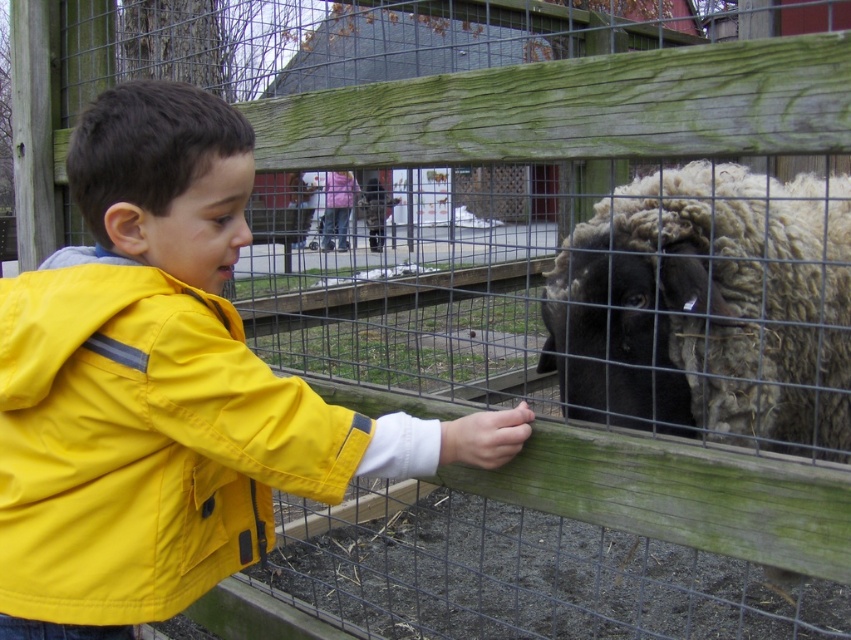
Is yellow matte jacket at center below yellow matte jacket at left?

No.

Is the position of yellow matte jacket at center more distant than that of yellow matte jacket at left?

Yes, yellow matte jacket at center is further from the viewer.

Is point (92, 148) behind point (237, 368)?

Yes, point (92, 148) is farther from viewer.

Find the location of a particular element. The width and height of the screenshot is (851, 640). yellow matte jacket at center is located at coordinates (164, 387).

Can you confirm if yellow matte jacket at center is positioned to the left of black woolly sheep at center?

Yes, yellow matte jacket at center is to the left of black woolly sheep at center.

What do you see at coordinates (164, 387) in the screenshot? This screenshot has width=851, height=640. I see `yellow matte jacket at center` at bounding box center [164, 387].

The image size is (851, 640). In order to click on yellow matte jacket at center in this screenshot , I will do `click(164, 387)`.

The width and height of the screenshot is (851, 640). In order to click on yellow matte jacket at left in this screenshot , I will do `click(143, 442)`.

From the picture: Between yellow matte jacket at left and black woolly sheep at center, which one appears on the right side from the viewer's perspective?

black woolly sheep at center

Between point (107, 502) and point (680, 419), which one is positioned behind?

Positioned behind is point (680, 419).

I want to click on yellow matte jacket at left, so click(x=143, y=442).